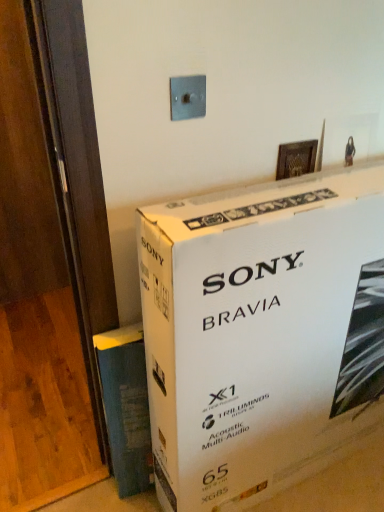
The image size is (384, 512). What do you see at coordinates (126, 406) in the screenshot?
I see `blue textured paper at lower left` at bounding box center [126, 406].

The width and height of the screenshot is (384, 512). I want to click on white cardboard box at upper center, so click(261, 333).

Is there a large distance between white cardboard box at upper center and blue textured paper at lower left?

white cardboard box at upper center is actually quite close to blue textured paper at lower left.

Which is correct: white cardboard box at upper center is inside blue textured paper at lower left, or outside of it?

white cardboard box at upper center is spatially situated outside blue textured paper at lower left.

Which is more to the right, white cardboard box at upper center or blue textured paper at lower left?

Positioned to the right is white cardboard box at upper center.

Considering the sizes of white cardboard box at upper center and blue textured paper at lower left in the image, is white cardboard box at upper center wider or thinner than blue textured paper at lower left?

Clearly, white cardboard box at upper center has more width compared to blue textured paper at lower left.

Is metallic gray switch at upper center shorter than white cardboard box at upper center?

Correct, metallic gray switch at upper center is not as tall as white cardboard box at upper center.

Identify the location of electric outlet behind the white cardboard box at upper center. (187, 97).

Can you confirm if metallic gray switch at upper center is bigger than white cardboard box at upper center?

Actually, metallic gray switch at upper center might be smaller than white cardboard box at upper center.

Is blue textured paper at lower left closer to the viewer compared to white cardboard box at upper center?

No, blue textured paper at lower left is further to the viewer.

Is point (109, 341) positioned behind point (233, 375)?

That is True.

Is blue textured paper at lower left at the right side of white cardboard box at upper center?

Incorrect, blue textured paper at lower left is not on the right side of white cardboard box at upper center.

Is white cardboard box at upper center a part of blue textured paper at lower left?

No, white cardboard box at upper center is not surrounded by blue textured paper at lower left.

From a real-world perspective, is white cardboard box at upper center located higher than metallic gray switch at upper center?

No, from a real-world perspective, white cardboard box at upper center is not above metallic gray switch at upper center.

Is point (165, 303) behind point (192, 103)?

No, (165, 303) is closer to viewer.

In the scene shown: Is white cardboard box at upper center oriented away from metallic gray switch at upper center?

white cardboard box at upper center is not turned away from metallic gray switch at upper center.

Is white cardboard box at upper center inside or outside of metallic gray switch at upper center?

white cardboard box at upper center exists outside the volume of metallic gray switch at upper center.

From the image's perspective, would you say metallic gray switch at upper center is positioned over wooden at left?

Yes, from the image's perspective, metallic gray switch at upper center is over wooden at left.

Which of these two, metallic gray switch at upper center or wooden at left, stands shorter?

wooden at left is shorter.

Is metallic gray switch at upper center placed right next to wooden at left?

They are not placed beside each other.

Is the depth of metallic gray switch at upper center less than that of wooden at left?

Yes, it is in front of wooden at left.

Is blue textured paper at lower left closer to camera compared to metallic gray switch at upper center?

No, it is not.

In the image, there is a metallic gray switch at upper center. At what (x,y) coordinates should I click in order to perform the action: click on paperback book below it (from the image's perspective). Please return your answer as a coordinate pair (x, y). The width and height of the screenshot is (384, 512). Looking at the image, I should click on (126, 406).

Is blue textured paper at lower left facing towards metallic gray switch at upper center?

No, blue textured paper at lower left is not oriented towards metallic gray switch at upper center.

From a real-world perspective, between blue textured paper at lower left and metallic gray switch at upper center, who is vertically lower?

blue textured paper at lower left.

From a real-world perspective, is wooden at left on top of white cardboard box at upper center?

Actually, wooden at left is physically below white cardboard box at upper center in the real world.

Considering the relative positions of wooden at left and white cardboard box at upper center in the image provided, is wooden at left to the right of white cardboard box at upper center from the viewer's perspective?

No, wooden at left is not to the right of white cardboard box at upper center.

Can you tell me how much wooden at left and white cardboard box at upper center differ in facing direction?

There is a 1.1-degree angle between the facing directions of wooden at left and white cardboard box at upper center.

From the image's perspective, between wooden at left and white cardboard box at upper center, who is located below?

From the image's view, wooden at left is below.

I want to click on paperback book below the white cardboard box at upper center (from the image's perspective), so click(126, 406).

Find the location of `box on the right of metallic gray switch at upper center`. box on the right of metallic gray switch at upper center is located at coordinates (261, 333).

Looking at the image, which one is located further to white cardboard box at upper center, wooden at left or metallic gray switch at upper center?

wooden at left is further to white cardboard box at upper center.

Estimate the real-world distances between objects in this image. Which object is further from white cardboard box at upper center, blue textured paper at lower left or wooden at left?

wooden at left is further to white cardboard box at upper center.

Considering their positions, is white cardboard box at upper center positioned closer to blue textured paper at lower left than wooden at left?

The object closer to blue textured paper at lower left is white cardboard box at upper center.

When comparing their distances from metallic gray switch at upper center, does wooden at left or blue textured paper at lower left seem further?

wooden at left.

Based on their spatial positions, is blue textured paper at lower left or wooden at left further from metallic gray switch at upper center?

The object further to metallic gray switch at upper center is wooden at left.

From the picture: Estimate the real-world distances between objects in this image. Which object is closer to wooden at left, blue textured paper at lower left or white cardboard box at upper center?

The object closer to wooden at left is blue textured paper at lower left.

From the image, which object appears to be farther from blue textured paper at lower left, wooden at left or white cardboard box at upper center?

Among the two, wooden at left is located further to blue textured paper at lower left.

Based on their spatial positions, is wooden at left or white cardboard box at upper center closer to metallic gray switch at upper center?

white cardboard box at upper center lies closer to metallic gray switch at upper center than the other object.

Locate an element on the screen. paperback book between wooden at left and white cardboard box at upper center from left to right is located at coordinates (126, 406).

In order to click on box between metallic gray switch at upper center and blue textured paper at lower left in the up-down direction in this screenshot , I will do `click(261, 333)`.

Locate an element on the screen. The width and height of the screenshot is (384, 512). plywood that lies between metallic gray switch at upper center and blue textured paper at lower left from top to bottom is located at coordinates (44, 405).

Image resolution: width=384 pixels, height=512 pixels. What are the coordinates of `electric outlet situated between wooden at left and white cardboard box at upper center from left to right` in the screenshot? It's located at (187, 97).